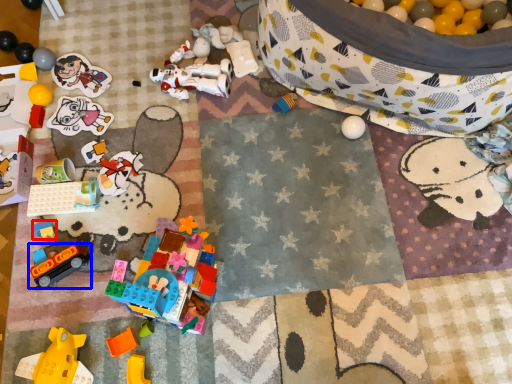
Question: Which point is closer to the camera, toy (highlighted by a red box) or toy (highlighted by a blue box)?

Choices:
 (A) toy
 (B) toy

Answer: (B)